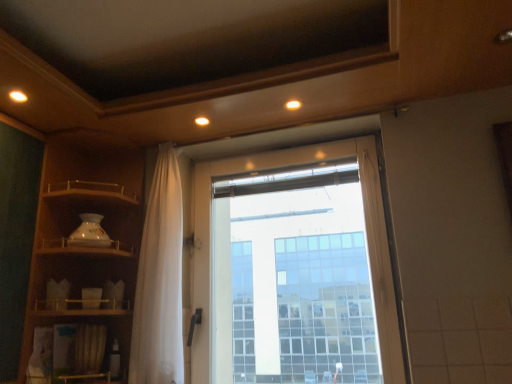
Question: Should I look upward or downward to see matte wood shelf at left?

Choices:
 (A) down
 (B) up

Answer: (A)

Question: From a real-world perspective, is transparent glass window at center physically below matte wood shelf at left?

Choices:
 (A) yes
 (B) no

Answer: (A)

Question: Does transparent glass window at center appear on the left side of matte wood shelf at left?

Choices:
 (A) yes
 (B) no

Answer: (B)

Question: From the image's perspective, is transparent glass window at center above matte wood shelf at left?

Choices:
 (A) yes
 (B) no

Answer: (B)

Question: Is transparent glass window at center further to camera compared to matte wood shelf at left?

Choices:
 (A) yes
 (B) no

Answer: (A)

Question: Does transparent glass window at center have a lesser width compared to matte wood shelf at left?

Choices:
 (A) no
 (B) yes

Answer: (B)

Question: Does transparent glass window at center have a smaller size compared to matte wood shelf at left?

Choices:
 (A) no
 (B) yes

Answer: (B)

Question: Is white sheer curtain at center behind transparent glass window at center?

Choices:
 (A) no
 (B) yes

Answer: (B)

Question: Is transparent glass window at center surrounded by white sheer curtain at center?

Choices:
 (A) yes
 (B) no

Answer: (B)

Question: Is white sheer curtain at center next to transparent glass window at center?

Choices:
 (A) yes
 (B) no

Answer: (B)

Question: Does white sheer curtain at center have a lesser width compared to transparent glass window at center?

Choices:
 (A) yes
 (B) no

Answer: (B)

Question: Does white sheer curtain at center have a greater width compared to transparent glass window at center?

Choices:
 (A) yes
 (B) no

Answer: (A)

Question: Does white sheer curtain at center have a lesser height compared to transparent glass window at center?

Choices:
 (A) no
 (B) yes

Answer: (A)

Question: Does matte wood shelf at left have a greater height compared to transparent glass window at center?

Choices:
 (A) yes
 (B) no

Answer: (A)